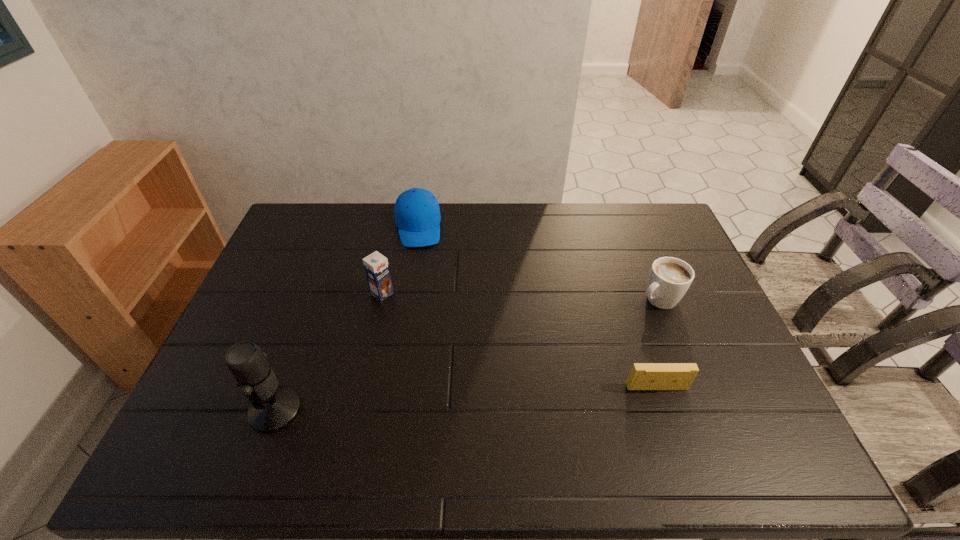
Where is `vacant space on the desktop that is between the microphone and the shortest object and is positioned on the front label of the second tallest object`? This screenshot has height=540, width=960. vacant space on the desktop that is between the microphone and the shortest object and is positioned on the front label of the second tallest object is located at coordinates (515, 396).

The image size is (960, 540). I want to click on vacant space on the desktop that is between the microphone and the shortest object and is positioned on the front-facing side of the farthest object, so click(x=436, y=401).

Find the location of a particular element. The image size is (960, 540). free space on the desktop that is between the microphone and the shortest object and is positioned with the handle on the side of the cappuccino is located at coordinates (504, 396).